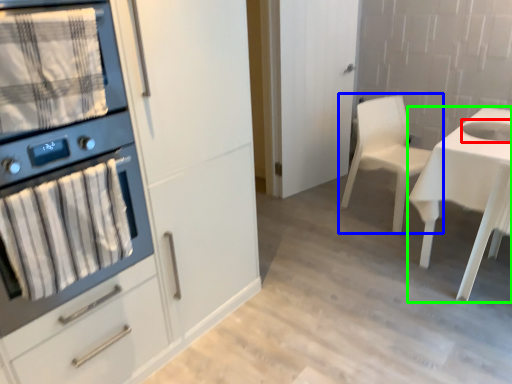
Question: Which object is positioned closest to sink (highlighted by a red box)? Select from chair (highlighted by a blue box) and desk (highlighted by a green box).

Choices:
 (A) chair
 (B) desk

Answer: (B)